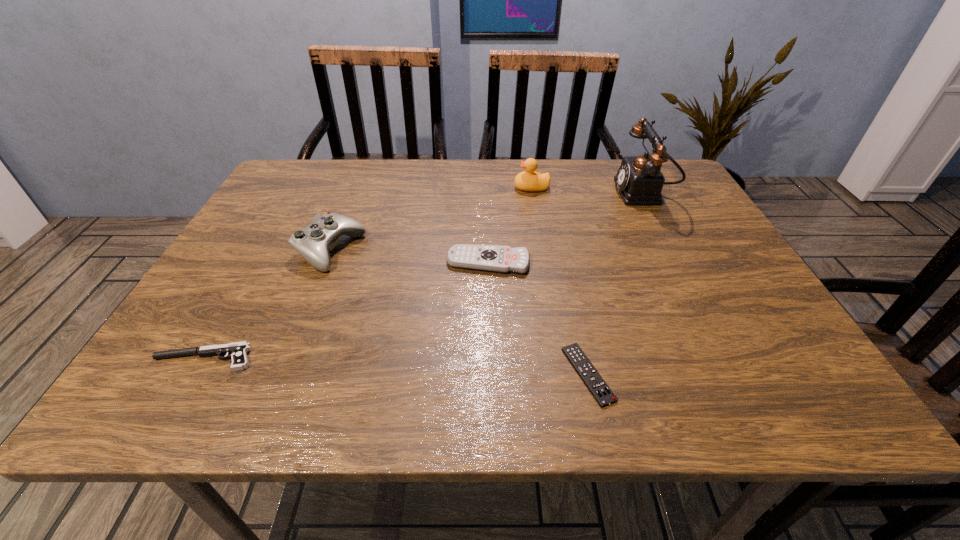
Locate an element on the screen. free space at the right edge of the desktop is located at coordinates point(677,229).

I want to click on vacant space at the near right corner of the desktop, so click(762, 371).

Where is `empty space that is in between the left remote control and the rightmost object`? empty space that is in between the left remote control and the rightmost object is located at coordinates (565, 228).

Image resolution: width=960 pixels, height=540 pixels. Find the location of `empty location between the control and the second shortest object`. empty location between the control and the second shortest object is located at coordinates (267, 305).

This screenshot has height=540, width=960. Find the location of `empty location between the tallest object and the shorter remote control`. empty location between the tallest object and the shorter remote control is located at coordinates (615, 284).

Identify the location of vacant space that's between the control and the duck. Image resolution: width=960 pixels, height=540 pixels. (431, 219).

At what (x,y) coordinates should I click in order to perform the action: click on free space that is in between the fourth tallest object and the second tallest object. Please return your answer as a coordinate pair (x, y). This screenshot has width=960, height=540. Looking at the image, I should click on (510, 225).

Find the location of a particular element. The image size is (960, 540). free space between the third shortest object and the second shortest object is located at coordinates (346, 310).

The image size is (960, 540). I want to click on unoccupied position between the nearer remote control and the rightmost object, so click(x=615, y=284).

Find the location of a particular element. This screenshot has height=540, width=960. free space that is in between the fourth tallest object and the nearer remote control is located at coordinates (538, 319).